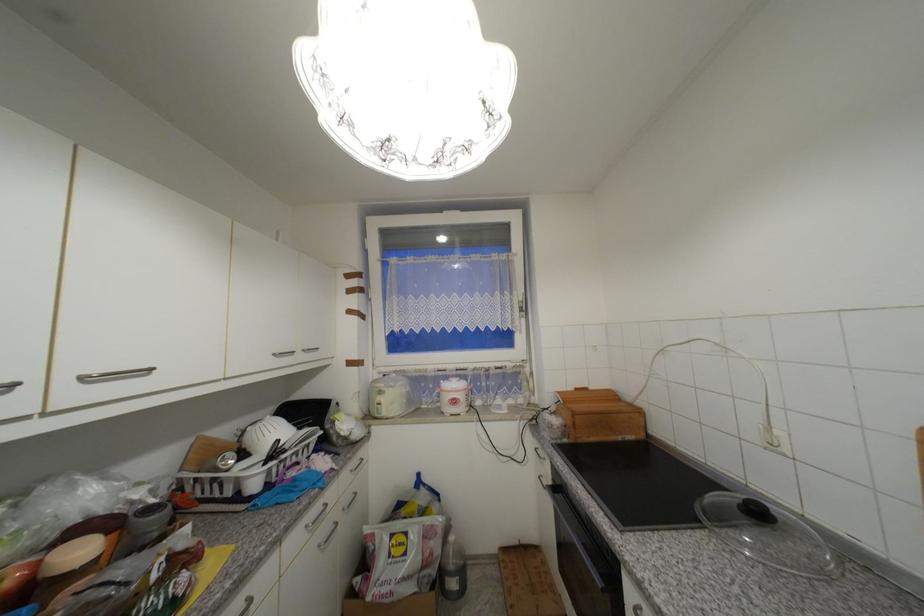
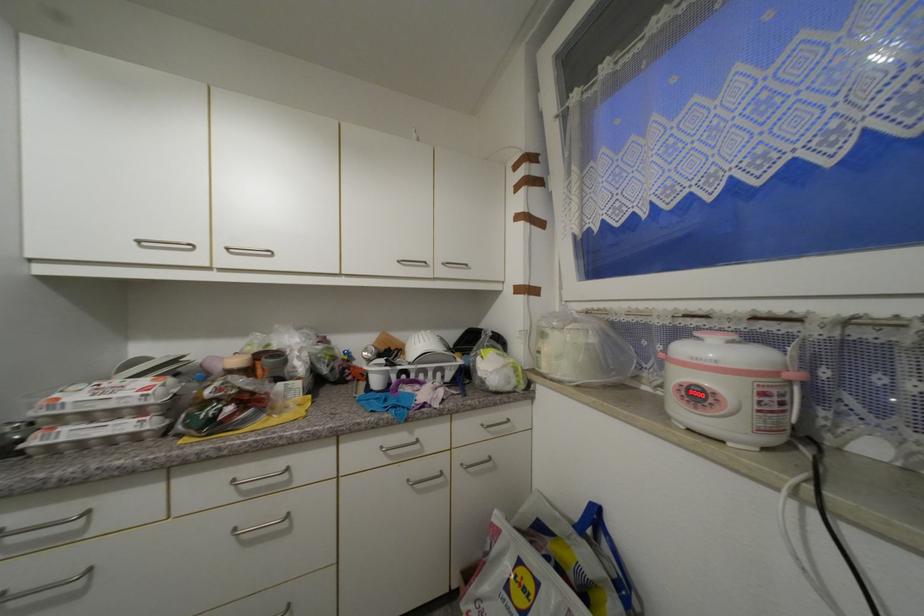
The point at (x=261, y=487) is marked in the first image. Where is the corresponding point in the second image?

(382, 384)